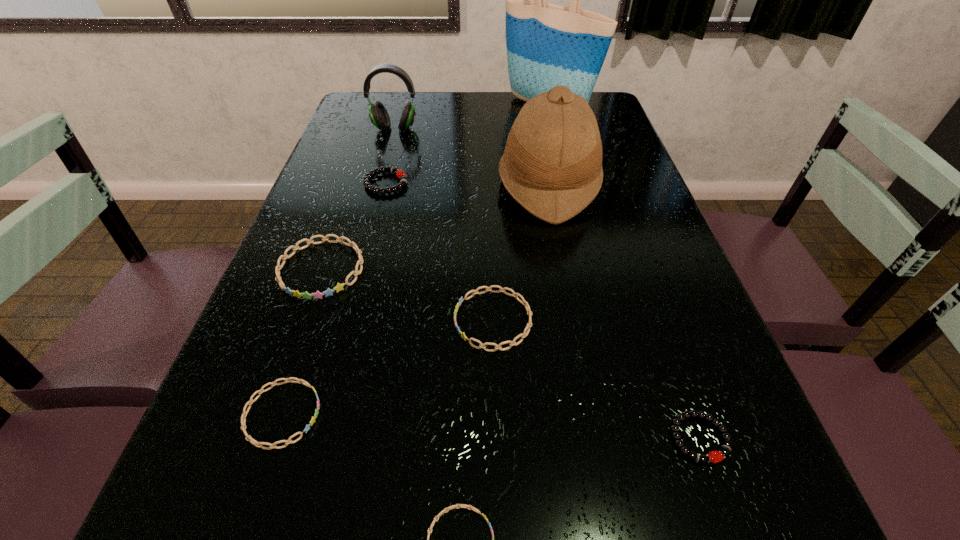
I want to click on the third farthest blue bracelet, so click(243, 418).

Locate an element on the screen. the rightmost bracelet is located at coordinates (725, 449).

Where is `the right black bracelet`? The height and width of the screenshot is (540, 960). the right black bracelet is located at coordinates (725, 449).

I want to click on vacant space situated 0.340m on the front of the blue tote bag, so click(x=566, y=186).

Locate an element on the screen. This screenshot has height=540, width=960. vacant space located on the front-facing side of the second tallest object is located at coordinates (464, 185).

Find the location of a particular element. This screenshot has width=960, height=540. blank space located 0.230m on the front-facing side of the second tallest object is located at coordinates (410, 185).

The image size is (960, 540). Find the location of `blank space located on the front-facing side of the second tallest object`. blank space located on the front-facing side of the second tallest object is located at coordinates (437, 185).

You are a GUI agent. You are given a task and a screenshot of the screen. Output one action in this format:
    pyautogui.click(x=<x>, y=<y>)
    Task: Click on the vacant space positioned on the ear cups of the seventh shortest object
    
    Given the screenshot: What is the action you would take?
    pyautogui.click(x=374, y=201)

At what (x,y) coordinates should I click in order to perform the action: click on vacant space located on the surface of the tallest bracelet showing star-shaped elements. Please return your answer as a coordinate pair (x, y). The height and width of the screenshot is (540, 960). Looking at the image, I should click on (273, 408).

Find the location of a particular element. Image resolution: width=960 pixels, height=540 pixels. vacant space located 0.100m on the surface of the second biggest blue bracelet showing star-shaped elements is located at coordinates (401, 320).